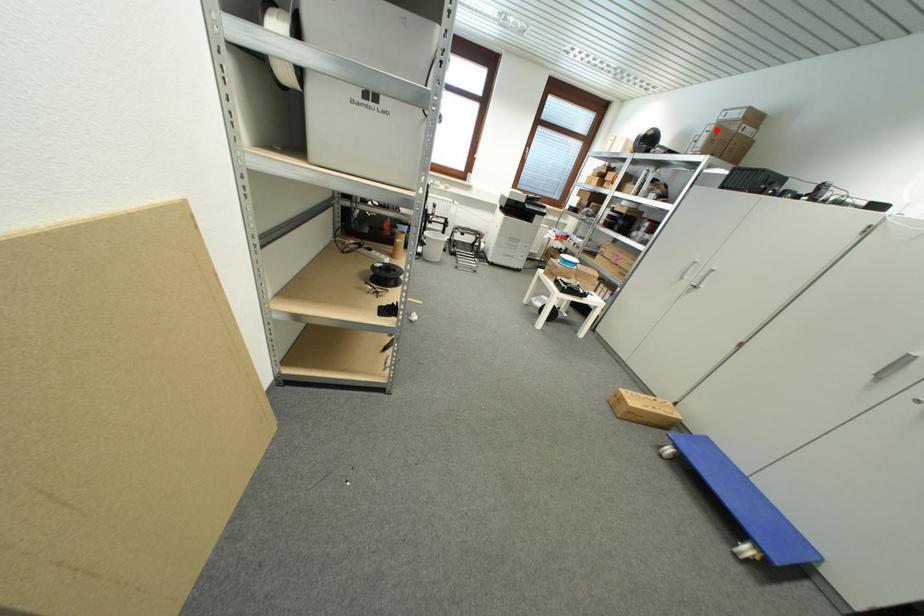
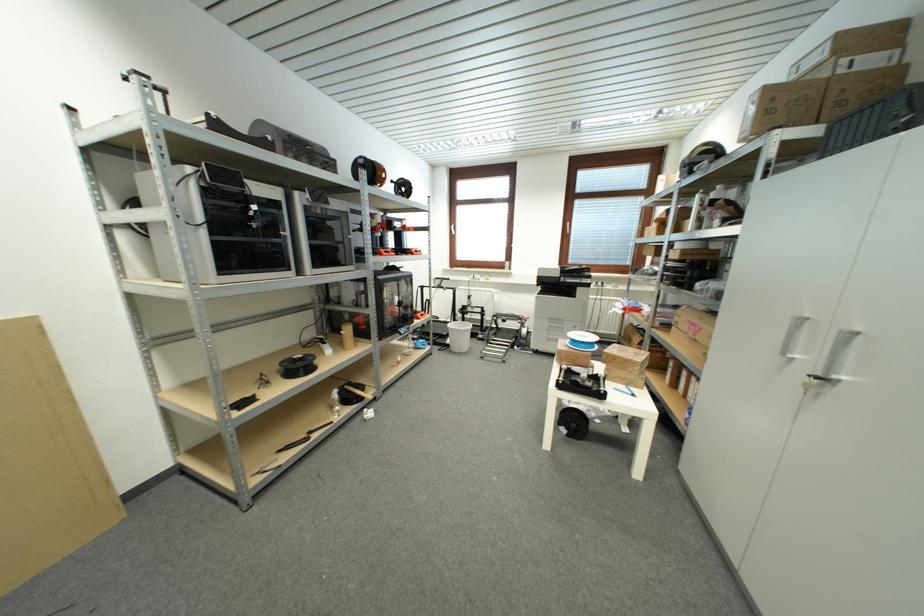
The point at the highlighted location is marked in the first image. Where is the corresponding point in the second image?

(761, 99)